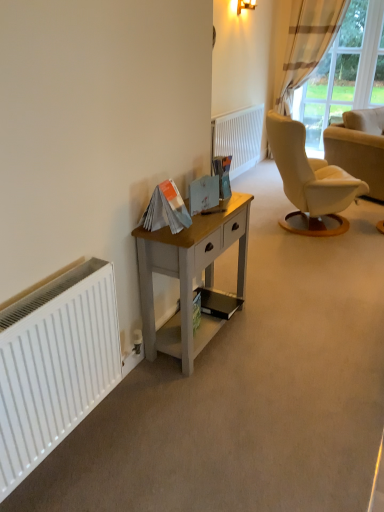
Identify the location of free location to the right of white matte radiator at left, which is the first radiator from front to back. (165, 443).